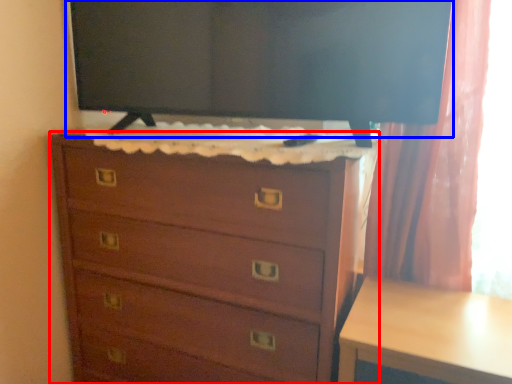
Question: Which object is closer to the camera taking this photo, chest of drawers (highlighted by a red box) or tv show (highlighted by a blue box)?

Choices:
 (A) chest of drawers
 (B) tv show

Answer: (A)